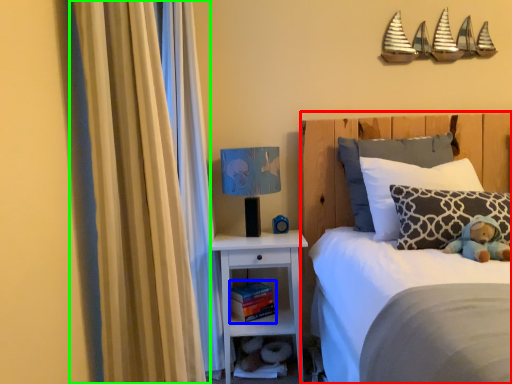
Question: Which object is the farthest from bed (highlighted by a red box)? Choose among these: book (highlighted by a blue box) or curtain (highlighted by a green box).

Choices:
 (A) book
 (B) curtain

Answer: (B)